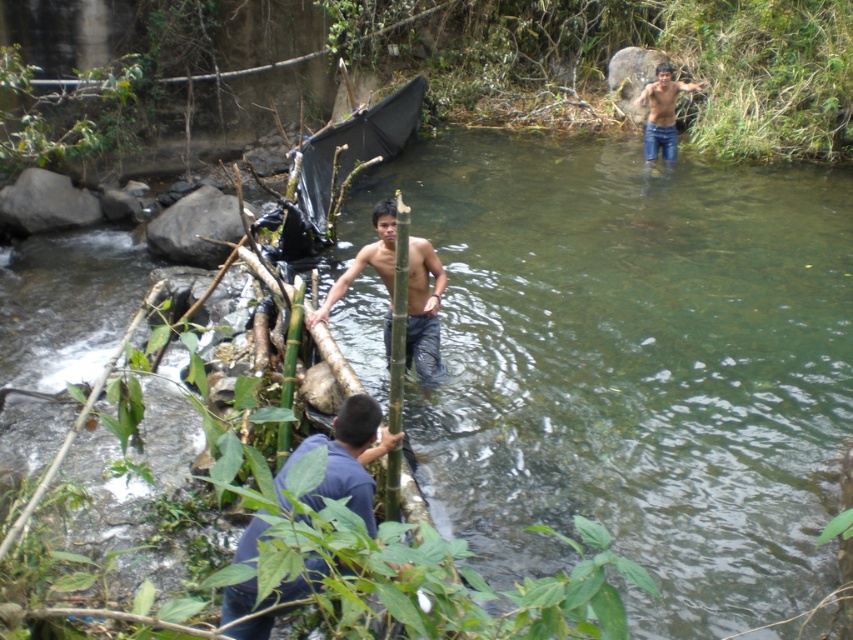
You are a photographer standing at the edge of the stream. You want to take a photo of both the blue cotton shirt at lower center and the smooth skin man at center. Which object should you focus on first to ensure both are in sharp focus?

The blue cotton shirt at lower center is closer to the viewer than the smooth skin man at center. To ensure both are in sharp focus, you should focus on the smooth skin man at center first, as focusing on the farther object allows a greater depth of field to include the closer object within the focus range.

You are hiking in a tropical forest and come across a stream with a bamboo bridge. You notice a blue cotton shirt at lower center and jeans at upper right. Which item is closer to the water?

The blue cotton shirt at lower center is closer to the water because it is positioned under the jeans at upper right.

You are standing on the bamboo structure and want to cross to the other side. The clear water at center flows towards the jeans at upper right. Which direction should you move to avoid the murky water?

You should move towards the clear water at center since it is in front of the jeans at upper right, indicating it is closer to the safe path.